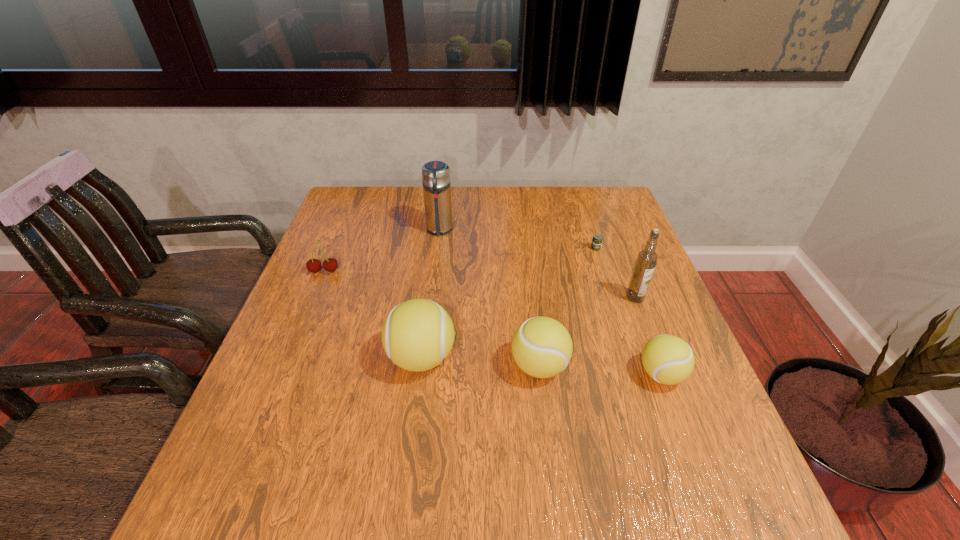
You are a GUI agent. You are given a task and a screenshot of the screen. Output one action in this format:
    pyautogui.click(x=<x>, y=<y>)
    Task: Click on the tennis ball located at the right edge
    This screenshot has width=960, height=540.
    Given the screenshot: What is the action you would take?
    [x=667, y=359]

The height and width of the screenshot is (540, 960). I want to click on beer can positioned at the right edge, so click(597, 239).

What are the coordinates of `vodka that is at the right edge` in the screenshot? It's located at (647, 258).

Where is `blank area at the far edge`? This screenshot has width=960, height=540. blank area at the far edge is located at coordinates (534, 218).

Identify the location of free region at the near edge of the desktop. (339, 455).

Locate an element on the screen. vacant area at the left edge is located at coordinates (336, 276).

This screenshot has height=540, width=960. Find the location of `vacant area at the right edge of the desktop`. vacant area at the right edge of the desktop is located at coordinates (602, 230).

Identify the location of free space at the far right corner of the desktop. (594, 213).

In order to click on vacant point located between the shortest tennis ball and the thermos bottle in this screenshot , I will do `click(550, 302)`.

This screenshot has height=540, width=960. I want to click on empty location between the thermos bottle and the fourth farthest object, so click(x=538, y=264).